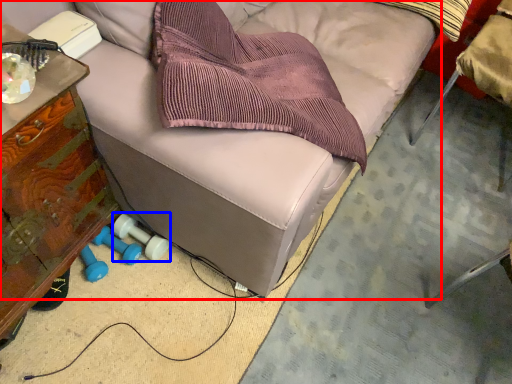
Question: Which object appears farthest to the camera in this image, furniture (highlighted by a red box) or dumbbell (highlighted by a blue box)?

Choices:
 (A) furniture
 (B) dumbbell

Answer: (B)